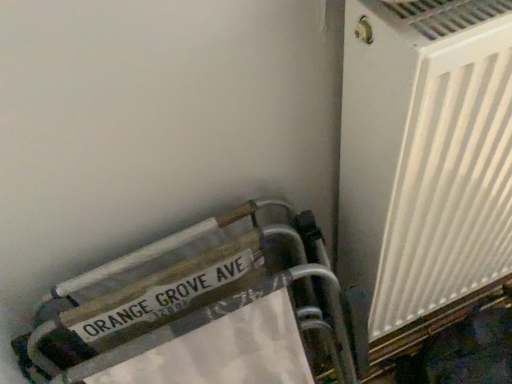
Question: From the image's perspective, is wooden sign at lower left above or below white plastic radiator at right?

Choices:
 (A) below
 (B) above

Answer: (A)

Question: Is wooden sign at lower left in front of or behind white plastic radiator at right in the image?

Choices:
 (A) front
 (B) behind

Answer: (B)

Question: Considering the positions of wooden sign at lower left and white plastic radiator at right in the image, is wooden sign at lower left taller or shorter than white plastic radiator at right?

Choices:
 (A) tall
 (B) short

Answer: (B)

Question: Does point (485, 107) appear closer or farther from the camera than point (89, 306)?

Choices:
 (A) farther
 (B) closer

Answer: (B)

Question: Based on their positions, is white plastic radiator at right located to the left or right of wooden sign at lower left?

Choices:
 (A) left
 (B) right

Answer: (B)

Question: Is white plastic radiator at right taller or shorter than wooden sign at lower left?

Choices:
 (A) short
 (B) tall

Answer: (B)

Question: Based on their sizes in the image, would you say white plastic radiator at right is bigger or smaller than wooden sign at lower left?

Choices:
 (A) big
 (B) small

Answer: (A)